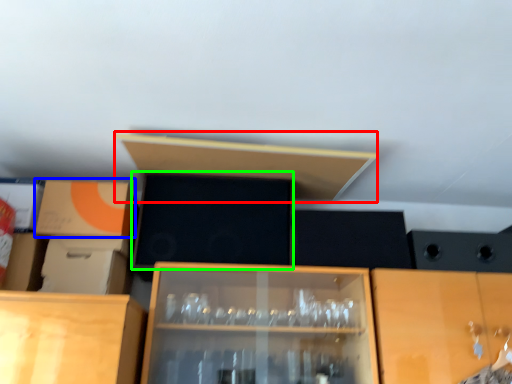
Question: Which object is positioned closest to shelf (highlighted by a red box)? Select from cardboard box (highlighted by a blue box) and box (highlighted by a green box).

Choices:
 (A) cardboard box
 (B) box

Answer: (B)